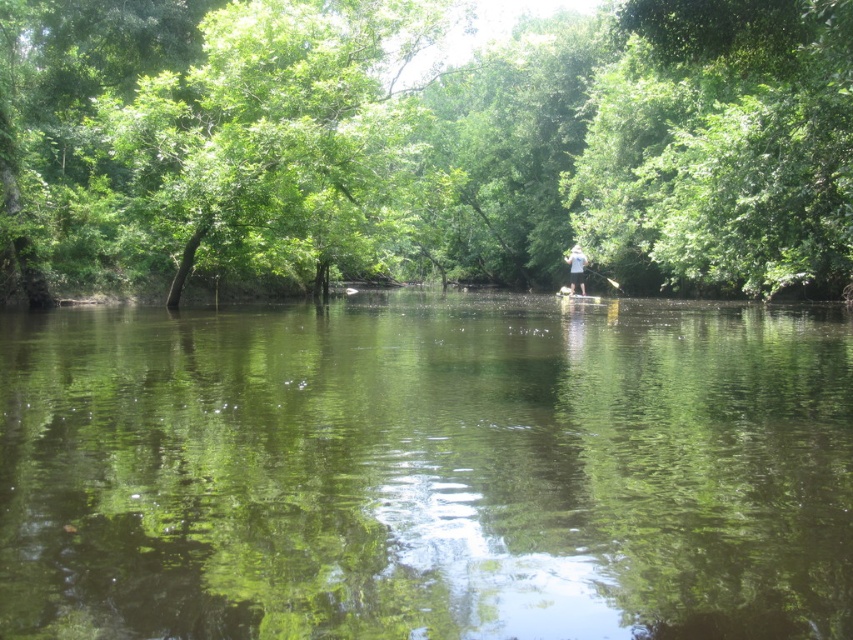
Find the location of a particular element. This screenshot has height=640, width=853. white cotton shirt at center is located at coordinates (576, 268).

Is white cotton shirt at center to the left of white plastic paddle at center from the viewer's perspective?

Indeed, white cotton shirt at center is positioned on the left side of white plastic paddle at center.

Where is `white cotton shirt at center`? The width and height of the screenshot is (853, 640). white cotton shirt at center is located at coordinates (576, 268).

The height and width of the screenshot is (640, 853). Identify the location of white cotton shirt at center. (576, 268).

Does point (149, 401) lie in front of point (573, 266)?

Yes, point (149, 401) is in front of point (573, 266).

Find the location of a particular element. green reflective water at center is located at coordinates (427, 468).

Can you confirm if green leafy tree at center is positioned above white cotton shirt at center?

Indeed, green leafy tree at center is positioned over white cotton shirt at center.

Which of these two, green leafy tree at center or white cotton shirt at center, stands taller?

green leafy tree at center

Find the location of a particular element. green leafy tree at center is located at coordinates (424, 147).

You are a GUI agent. You are given a task and a screenshot of the screen. Output one action in this format:
    pyautogui.click(x=<x>, y=<y>)
    Task: Click on the green leafy tree at center
    This screenshot has width=853, height=640.
    Given the screenshot: What is the action you would take?
    pyautogui.click(x=424, y=147)